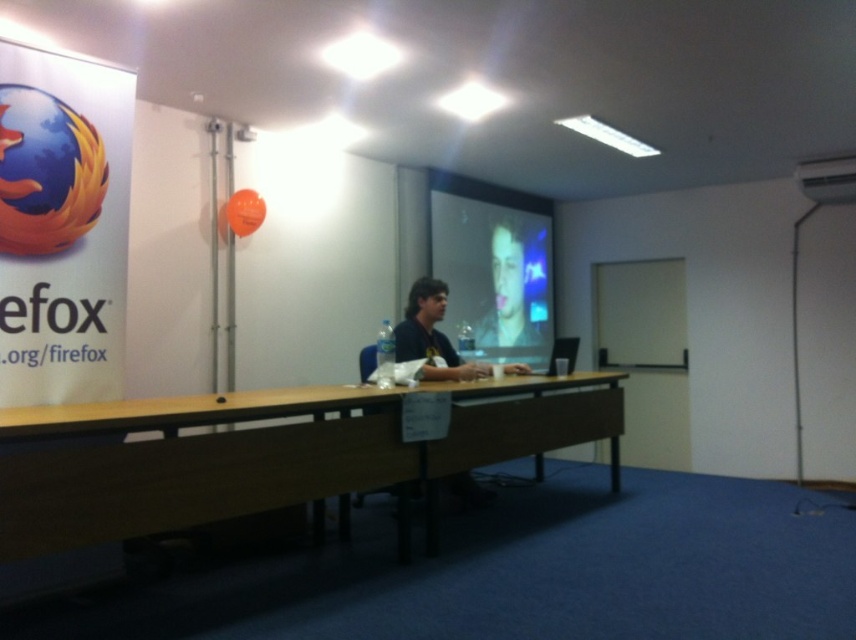
What object is located at the coordinates point (494,268)?

The object at point (494,268) is the matte plastic projector screen at center.

You are standing in the conference room and want to place a laptop on the brown wooden table at center. However, there is a person wearing a dark blue shirt at center sitting at the table. Can you easily access the table to place the laptop without disturbing them?

The brown wooden table at center is closer to the viewer than dark blue shirt at center, so you can likely access the table without disturbing the person since it is nearer to you.